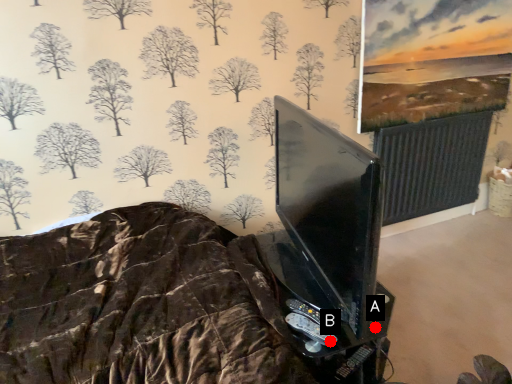
Question: Two points are circled on the image, labeled by A and B beside each circle. Which of the following is the closest to the observer?

Choices:
 (A) A is closer
 (B) B is closer

Answer: (B)